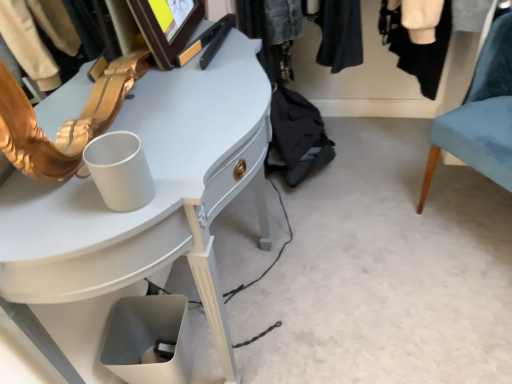
This screenshot has height=384, width=512. Find the location of `free spot to the right of white glossy desk at upper left`. free spot to the right of white glossy desk at upper left is located at coordinates (368, 276).